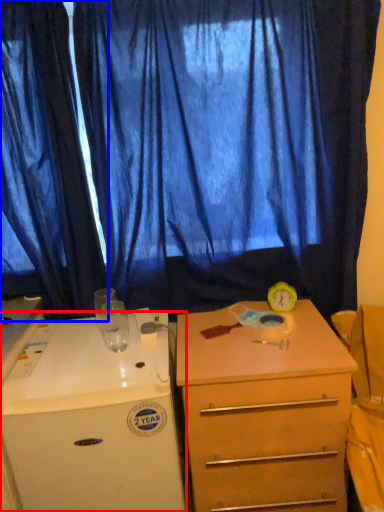
Question: Which point is closer to the camera, desk (highlighted by a red box) or curtain (highlighted by a blue box)?

Choices:
 (A) desk
 (B) curtain

Answer: (A)